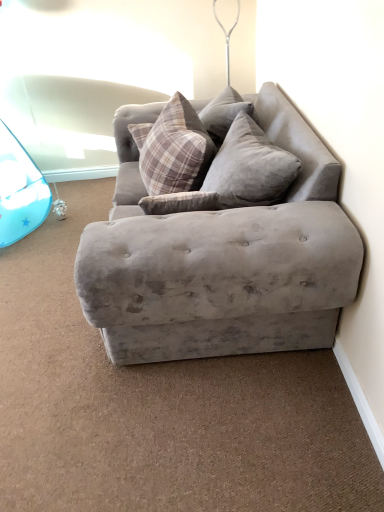
Question: Can you confirm if velvet gray pillow at center, positioned as the first pillow in right-to-left order, is wider than velvet gray couch at center?

Choices:
 (A) yes
 (B) no

Answer: (B)

Question: Would you consider velvet gray pillow at center, positioned as the first pillow in right-to-left order, to be distant from velvet gray couch at center?

Choices:
 (A) yes
 (B) no

Answer: (B)

Question: Would you say velvet gray pillow at center, positioned as the first pillow in right-to-left order, is outside velvet gray couch at center?

Choices:
 (A) no
 (B) yes

Answer: (A)

Question: Considering the relative sizes of velvet gray pillow at center, acting as the second pillow starting from the left, and velvet gray couch at center in the image provided, is velvet gray pillow at center, acting as the second pillow starting from the left, shorter than velvet gray couch at center?

Choices:
 (A) no
 (B) yes

Answer: (B)

Question: From a real-world perspective, is velvet gray pillow at center, positioned as the first pillow in right-to-left order, on velvet gray couch at center?

Choices:
 (A) no
 (B) yes

Answer: (B)

Question: Can you confirm if velvet gray pillow at center, acting as the second pillow starting from the left, is smaller than velvet gray couch at center?

Choices:
 (A) no
 (B) yes

Answer: (B)

Question: Is velvet gray pillow at center, acting as the second pillow starting from the left, surrounded by plaid fabric pillow at upper center, the first pillow from the left?

Choices:
 (A) no
 (B) yes

Answer: (A)

Question: Is plaid fabric pillow at upper center, the first pillow from the left, at the right side of velvet gray pillow at center, positioned as the first pillow in right-to-left order?

Choices:
 (A) yes
 (B) no

Answer: (B)

Question: Does plaid fabric pillow at upper center, which ranks as the 2th pillow in right-to-left order, have a greater width compared to velvet gray pillow at center, acting as the second pillow starting from the left?

Choices:
 (A) yes
 (B) no

Answer: (B)

Question: Is plaid fabric pillow at upper center, the first pillow from the left, oriented away from velvet gray pillow at center, acting as the second pillow starting from the left?

Choices:
 (A) no
 (B) yes

Answer: (A)

Question: Is plaid fabric pillow at upper center, which ranks as the 2th pillow in right-to-left order, aimed at velvet gray pillow at center, acting as the second pillow starting from the left?

Choices:
 (A) yes
 (B) no

Answer: (B)

Question: From a real-world perspective, is plaid fabric pillow at upper center, the first pillow from the left, over velvet gray pillow at center, acting as the second pillow starting from the left?

Choices:
 (A) no
 (B) yes

Answer: (A)

Question: Is velvet gray couch at center outside of velvet gray pillow at center, acting as the second pillow starting from the left?

Choices:
 (A) no
 (B) yes

Answer: (B)